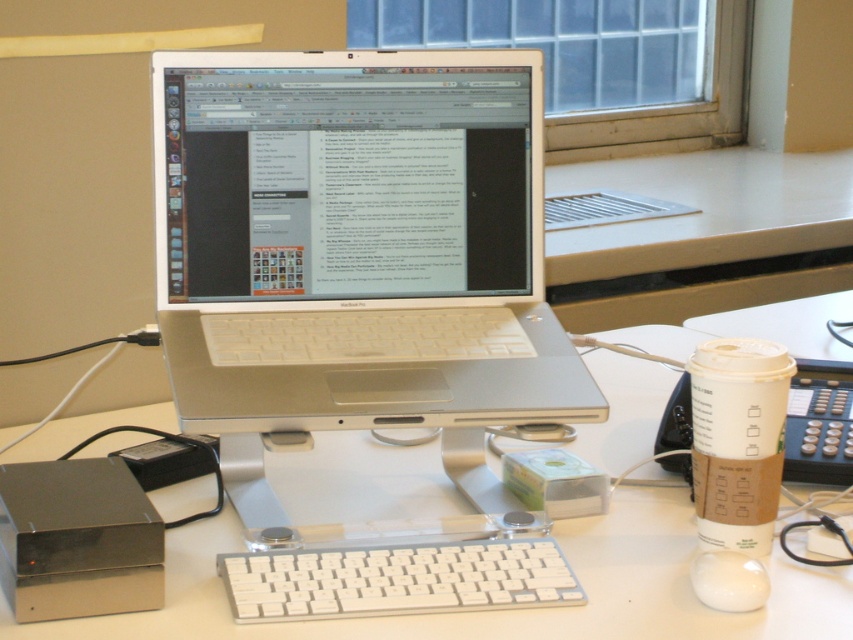
Question: Which object appears farthest from the camera in this image?

Choices:
 (A) white plastic computer desk at center
 (B) white plastic keyboard at center
 (C) white plastic laptop at center
 (D) white glossy mouse at lower right

Answer: (C)

Question: Considering the relative positions of white plastic laptop at center and white plastic keyboard at center in the image provided, where is white plastic laptop at center located with respect to white plastic keyboard at center?

Choices:
 (A) below
 (B) above

Answer: (B)

Question: Which of the following is the farthest from the observer?

Choices:
 (A) white plastic computer desk at center
 (B) white plastic laptop at center
 (C) white plastic keyboard at center
 (D) white glossy mouse at lower right

Answer: (B)

Question: Which point is closer to the camera?

Choices:
 (A) white plastic keyboard at center
 (B) white plastic laptop at center
 (C) white glossy mouse at lower right
 (D) white plastic computer desk at center

Answer: (D)

Question: Is white plastic computer desk at center thinner than white plastic keyboard at center?

Choices:
 (A) yes
 (B) no

Answer: (B)

Question: Can you confirm if white plastic computer desk at center is bigger than white plastic keyboard at center?

Choices:
 (A) yes
 (B) no

Answer: (A)